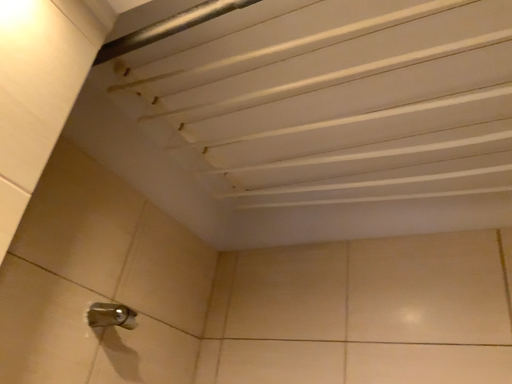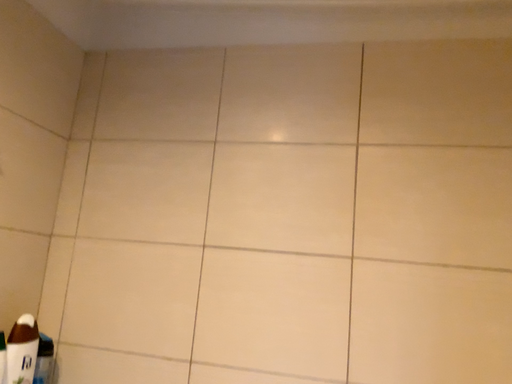
Question: Which way did the camera rotate in the video?

Choices:
 (A) rotated left
 (B) rotated right

Answer: (B)